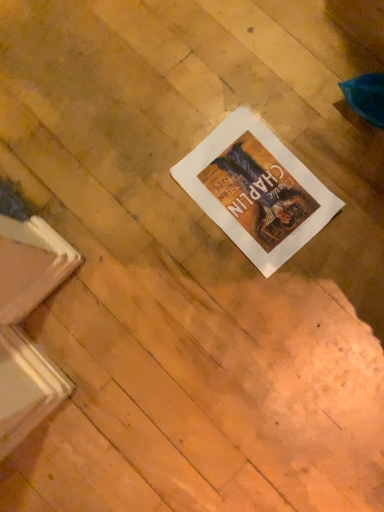
Where is `vacant space situated on the left part of white paper at center`? vacant space situated on the left part of white paper at center is located at coordinates (168, 263).